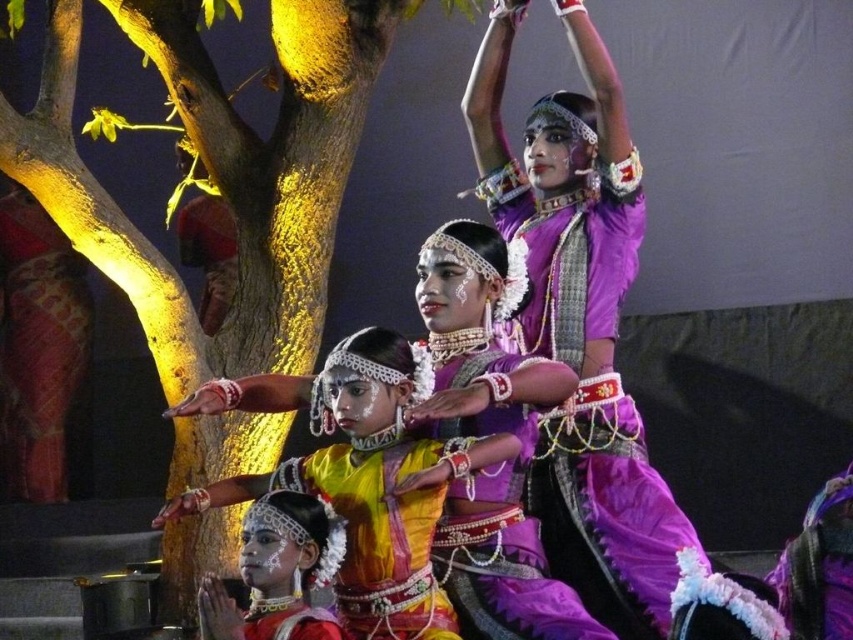
Question: Considering the relative positions of yellow satin saree at center and yellow satin blouse at center in the image provided, where is yellow satin saree at center located with respect to yellow satin blouse at center?

Choices:
 (A) above
 (B) below

Answer: (A)

Question: Which object appears farthest from the camera in this image?

Choices:
 (A) purple satin saree at center
 (B) matte yellow fabric at lower center
 (C) purple satin saree at upper center
 (D) textured red fabric at left

Answer: (D)

Question: Which object appears closest to the camera in this image?

Choices:
 (A) matte yellow fabric at lower center
 (B) textured red fabric at left

Answer: (A)

Question: Can you confirm if textured red fabric at left is thinner than matte yellow fabric at center?

Choices:
 (A) yes
 (B) no

Answer: (B)

Question: Can you confirm if yellow satin blouse at center is bigger than matte yellow fabric at lower center?

Choices:
 (A) yes
 (B) no

Answer: (A)

Question: Considering the real-world distances, which object is closest to the purple satin saree at center?

Choices:
 (A) textured red fabric at left
 (B) matte yellow fabric at lower center
 (C) yellow satin saree at center
 (D) yellow satin blouse at center

Answer: (C)